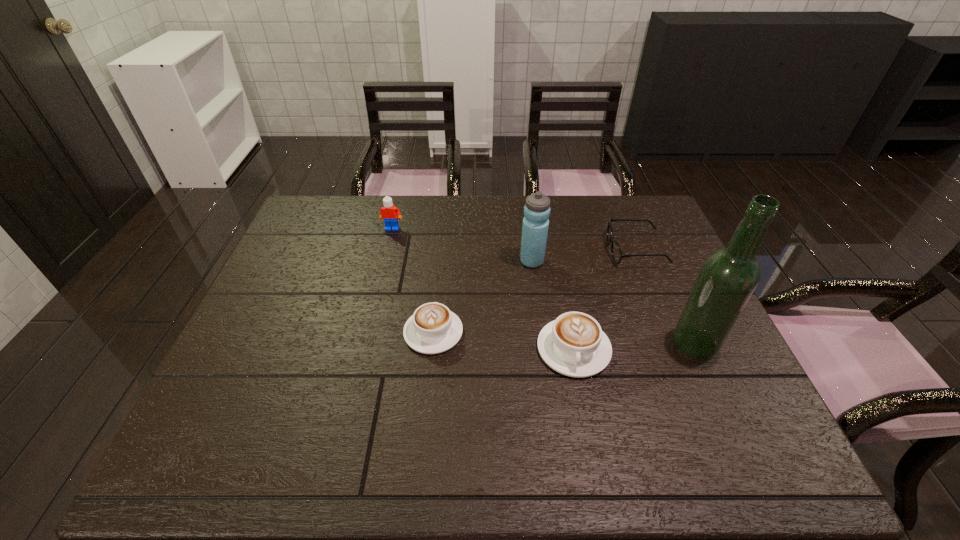
Where is `vacant space located 0.330m with the handle on the right side of the fifth object from right to left`? The height and width of the screenshot is (540, 960). vacant space located 0.330m with the handle on the right side of the fifth object from right to left is located at coordinates (444, 235).

In order to click on vacant region located with the handle on the right side of the fifth object from right to left in this screenshot , I will do pyautogui.click(x=440, y=273).

Where is `blank space located on the face of the Lego`? Image resolution: width=960 pixels, height=540 pixels. blank space located on the face of the Lego is located at coordinates [x=388, y=245].

Where is `vacant space situated on the front-facing side of the spectacles`? vacant space situated on the front-facing side of the spectacles is located at coordinates (579, 250).

Locate an element on the screen. This screenshot has width=960, height=540. blank space located on the front-facing side of the spectacles is located at coordinates (549, 250).

The image size is (960, 540). In order to click on free space located on the front-facing side of the spectacles in this screenshot , I will do `click(517, 250)`.

This screenshot has height=540, width=960. Find the location of `free location located 0.060m on the right of the second tallest object`. free location located 0.060m on the right of the second tallest object is located at coordinates point(564,261).

Locate an element on the screen. This screenshot has height=540, width=960. vacant space located on the back of the tallest object is located at coordinates (668, 283).

Find the location of a particular element. The height and width of the screenshot is (540, 960). Lego present at the far edge is located at coordinates (389, 212).

I want to click on spectacles that is at the far edge, so click(x=616, y=252).